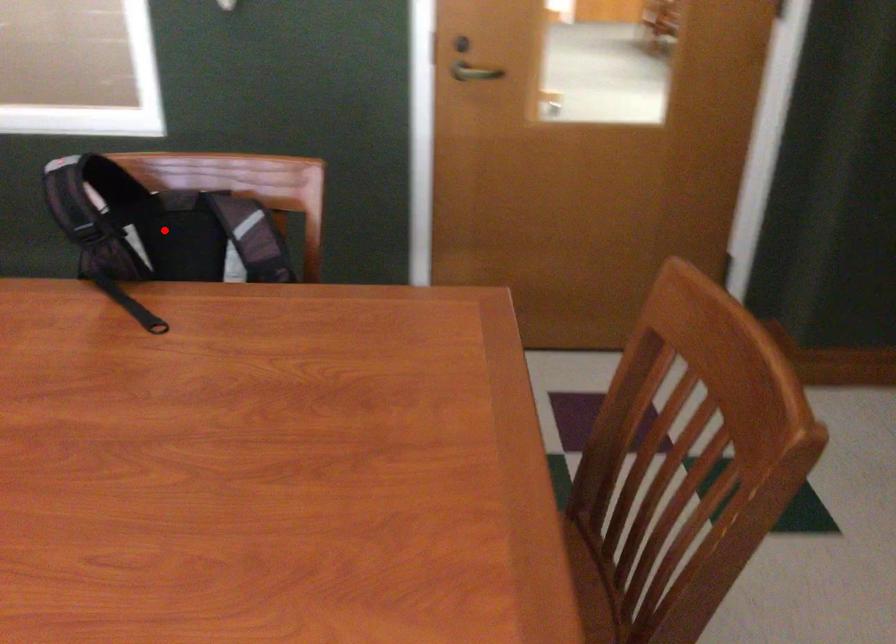
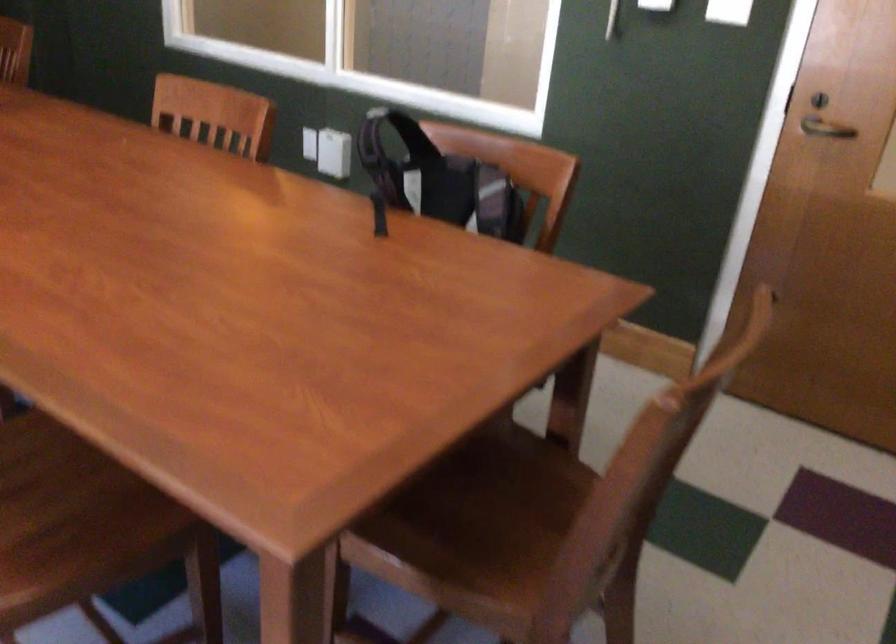
In the second image, find the point that corresponds to the highlighted location in the first image.

(438, 180)